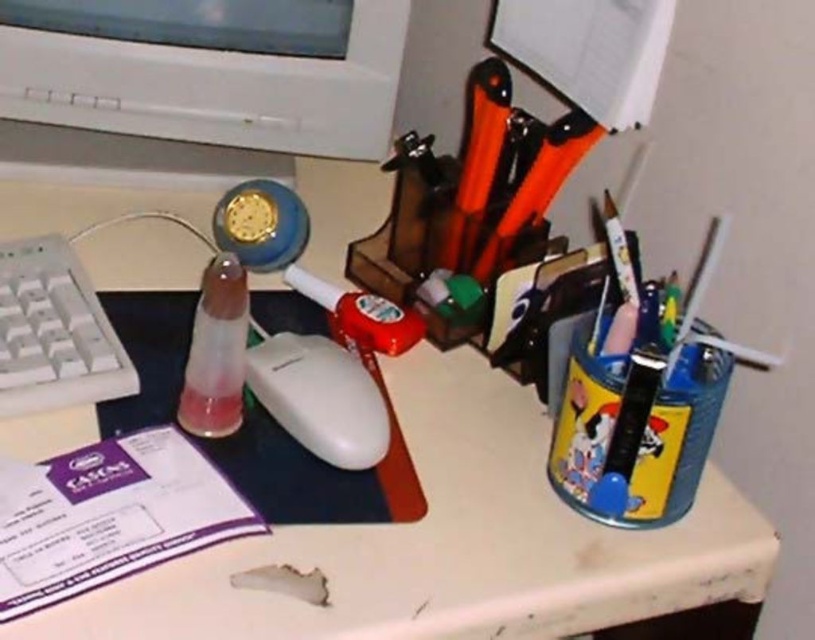
Looking at this image, you are looking at the desk from the front. There are two points marked on the desk surface, one at point coordinates point (100, 86) and another at point coordinates point (351, 340). Which point is closer to you?

Point (100, 86) is closer to you because it is further to the camera than point (351, 340).

You are standing 24 inches away from the desk. Can you reach the point at coordinates point (245, 330) without moving your position?

The distance of point (245, 330) from viewer is 22.33 inches, so yes, you can reach it since you are standing 24 inches away, which is closer than the point.

You are looking at the desk and notice two points marked on it. Which point is closer to you, point (240, 268) or point (368, 307)?

Point (240, 268) is closer to the viewer than point (368, 307).